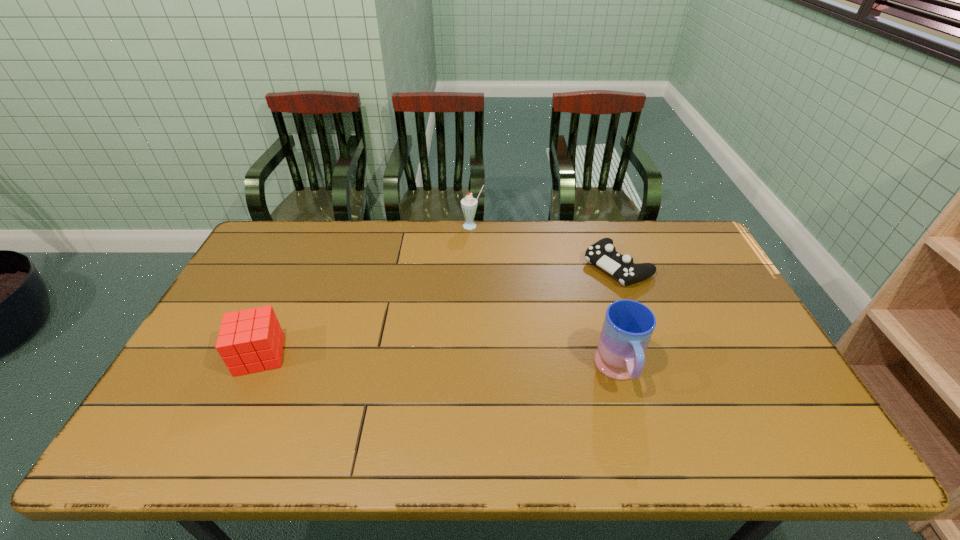
Find the location of a particular element. The image size is (960, 540). unoccupied area between the leftmost object and the mug is located at coordinates (440, 363).

This screenshot has width=960, height=540. Find the location of `free spot between the cube and the farthest object`. free spot between the cube and the farthest object is located at coordinates (x=366, y=291).

You are a GUI agent. You are given a task and a screenshot of the screen. Output one action in this format:
    pyautogui.click(x=<x>, y=<y>)
    Task: Click on the free space between the control and the second shortest object
    
    Given the screenshot: What is the action you would take?
    pyautogui.click(x=439, y=310)

Locate an element on the screen. Image resolution: width=960 pixels, height=540 pixels. the third closest object to the milkshake is located at coordinates tap(249, 341).

Point out which object is positioned as the third nearest to the leftmost object. Please provide its 2D coordinates. Your answer should be formatted as a tuple, i.e. [(x, y)], where the tuple contains the x and y coordinates of a point satisfying the conditions above.

[(602, 253)]

At what (x,y) coordinates should I click in order to perform the action: click on free spot that satisfies the following two spatial constraints: 1. on the front side of the milkshake; 2. on the right side of the control. Please return your answer as a coordinate pair (x, y). The width and height of the screenshot is (960, 540). Looking at the image, I should click on (472, 266).

Where is `free spot that satisfies the following two spatial constraints: 1. on the back side of the shortest object; 2. on the left side of the third tallest object`? This screenshot has height=540, width=960. free spot that satisfies the following two spatial constraints: 1. on the back side of the shortest object; 2. on the left side of the third tallest object is located at coordinates 300,266.

At what (x,y) coordinates should I click in order to perform the action: click on free location that satisfies the following two spatial constraints: 1. on the back side of the leftmost object; 2. on the right side of the milkshake. Please return your answer as a coordinate pair (x, y). Looking at the image, I should click on pos(320,226).